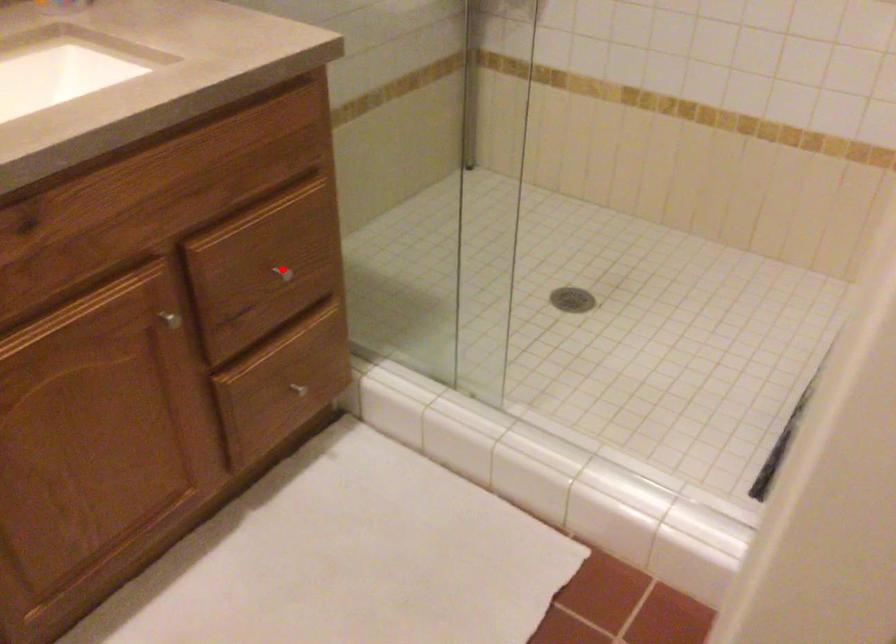
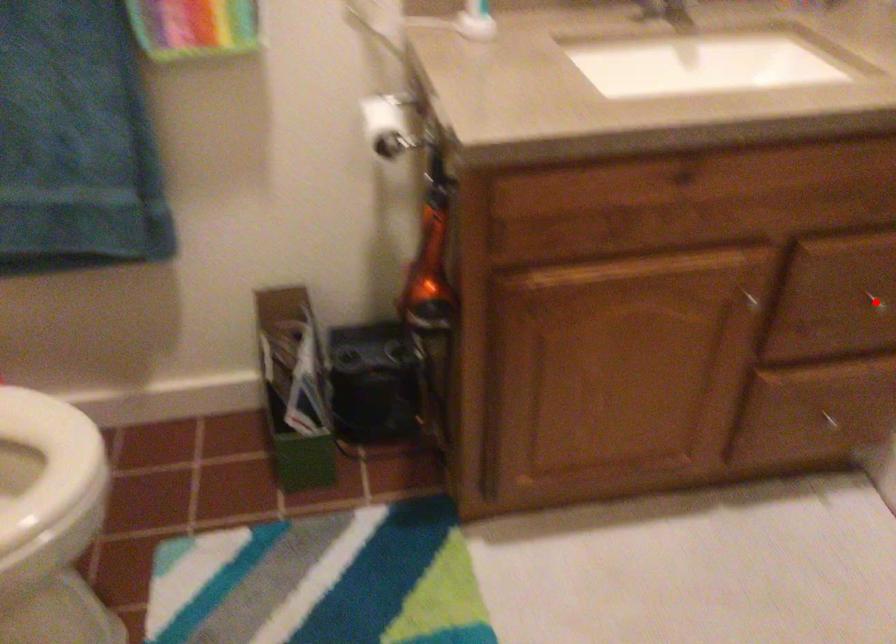
I am providing you with two images of the same scene from different viewpoints. A red point is marked on the first image and another point is marked on the second image. Is the marked point in image1 the same physical position as the marked point in image2?

Yes